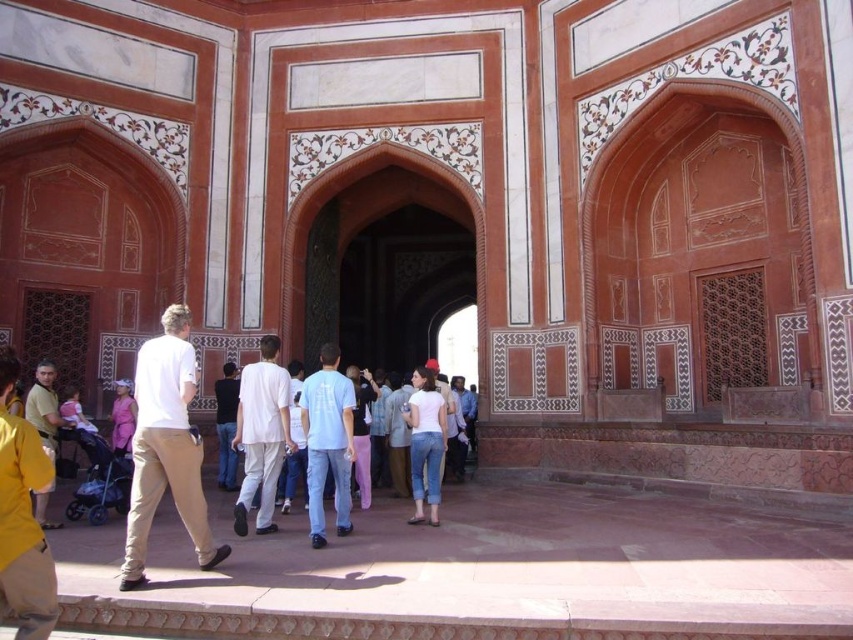
You are standing in the courtyard of a historical site with a large archway ahead. You notice a white cotton shirt at left and light blue jeans at center. Which object is taller?

The white cotton shirt at left is taller than the light blue jeans at center.

Consider the image. You are standing in the courtyard of the historical site. You notice two points marked on the ground. The first point is at coordinates point (268, 416), and the second point is at point (426, 408). If you were to walk from the first point to the second point, would you be moving towards the archway or away from it?

Since point (268, 416) is in front of point (426, 408), moving from the first point to the second point would mean walking away from the archway towards the courtyard.